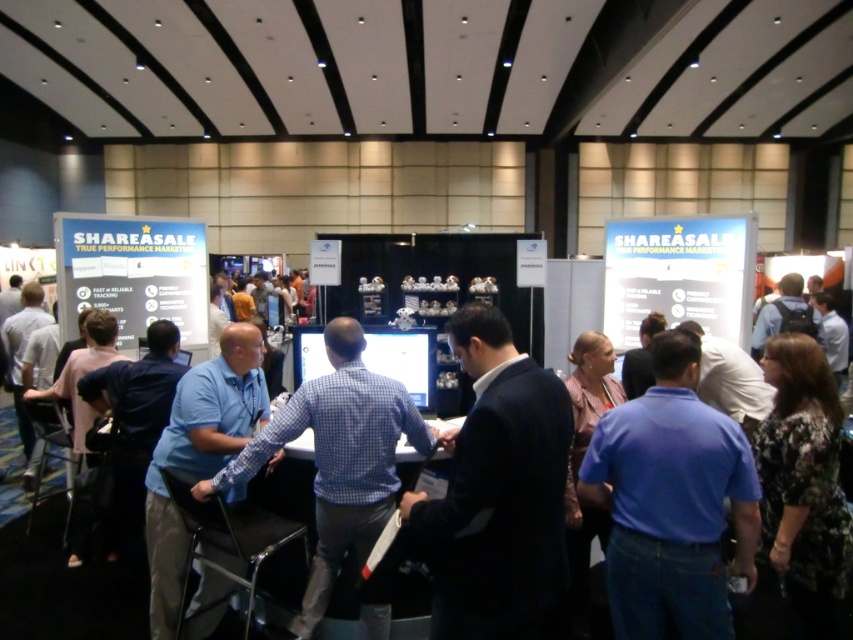
You are organizing a photo shoot at the ShareASale booth and need to ensure that the two people wearing blue shirts are visible in the frame. The camera you are using has a focus range that can accommodate objects up to 1 meter in width. Given the blue denim shirt at center and the blue shirt at center, which one might require adjustment to ensure it fits within the focus range?

The blue denim shirt at center has a smaller width than the blue shirt at center. Since the camera can accommodate up to 1 meter, the blue denim shirt at center should fit within the focus range without adjustment. However, the blue shirt at center, being wider, might exceed the 1 meter limit and require adjustment to ensure it fits within the focus range.

You are organizing a photo shoot at the ShareASale booth and need to ensure that all attendees are visible in the frame. Given that the dark blue suit at center and the blue denim shirt at center are both in the center, which attendee should you position closer to the edge to avoid overcrowding?

The dark blue suit at center has a lesser width compared to the blue denim shirt at center, so positioning the dark blue suit at center closer to the edge would help reduce overcrowding since it takes up less space.

You are at a trade show and want to approach the ShareASale booth. You see a dark blue suit at center. Where should you walk to in order to reach the booth?

The dark blue suit at center is located at point (497,493), so you should walk towards that coordinate to reach the ShareASale booth.